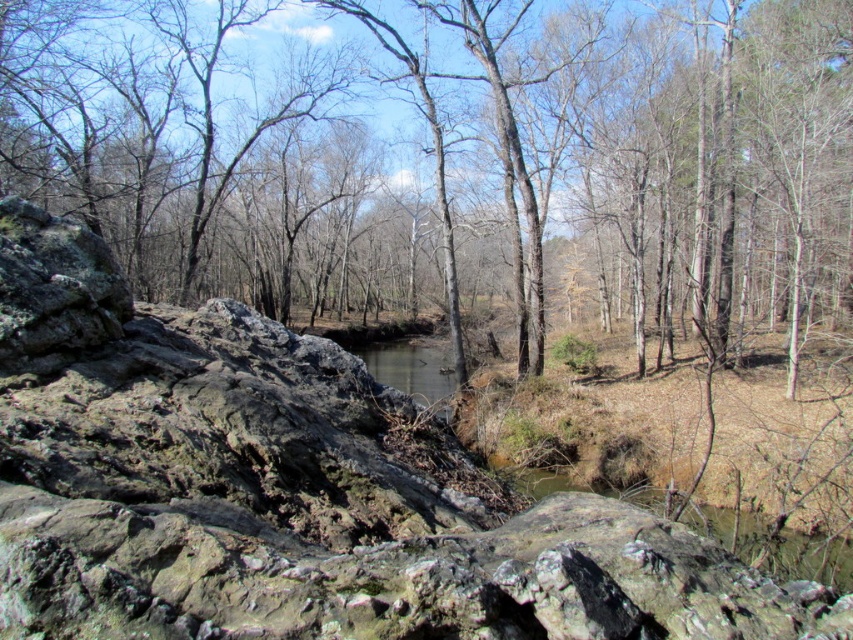
Question: Which object appears closest to the camera in this image?

Choices:
 (A) brown rough rock at left
 (B) rough textured rock at center

Answer: (B)

Question: Is brown rough rock at left behind rough textured rock at center?

Choices:
 (A) yes
 (B) no

Answer: (A)

Question: Is brown rough rock at left smaller than rough textured rock at center?

Choices:
 (A) no
 (B) yes

Answer: (A)

Question: Can you confirm if brown rough rock at left is thinner than rough textured rock at center?

Choices:
 (A) yes
 (B) no

Answer: (B)